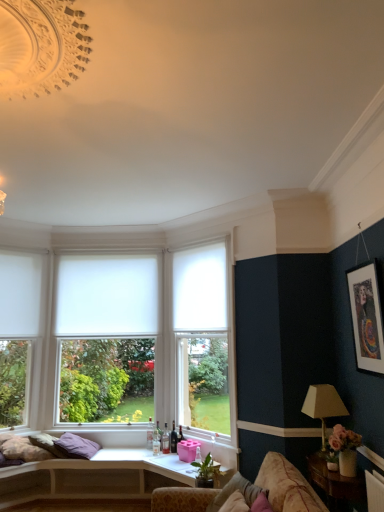
Question: Based on their positions, is wooden side table at lower right located to the left or right of white matte curtain at left, which is the first curtain in left-to-right order?

Choices:
 (A) left
 (B) right

Answer: (B)

Question: Is wooden side table at lower right spatially inside white matte curtain at left, the 2th curtain when ordered from right to left, or outside of it?

Choices:
 (A) outside
 (B) inside

Answer: (A)

Question: Which of these objects is positioned closest to the white matte window at center, positioned as the 2th window in left-to-right order?

Choices:
 (A) wooden at lower left
 (B) purple fabric pillow at lower left, placed as the second pillow when sorted from right to left
 (C) white matte curtain at left, the 2th curtain when ordered from right to left
 (D) wooden side table at lower right
 (E) white fabric lampshade at right

Answer: (C)

Question: Which of these objects is positioned farthest from the white matte curtain at left, the 2th curtain when ordered from right to left?

Choices:
 (A) pink fabric pillow at lower right, placed as the 1th pillow when sorted from top to bottom
 (B) white fabric lampshade at right
 (C) purple fabric pillow at lower left, marked as the first pillow in a bottom-to-top arrangement
 (D) white matte window at center, the 2th window when ordered from right to left
 (E) white matte window at left, marked as the 3th window in a right-to-left arrangement

Answer: (B)